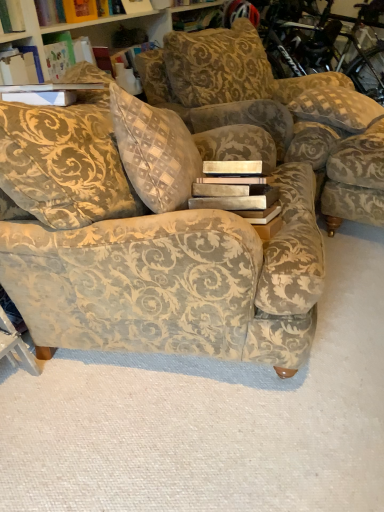
Where is `free space on the front side of velvet-patterned couch at center`? This screenshot has height=512, width=384. free space on the front side of velvet-patterned couch at center is located at coordinates (176, 441).